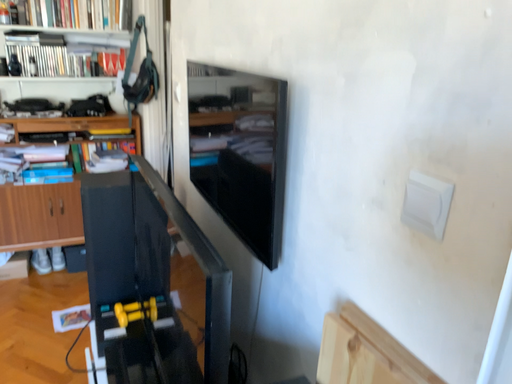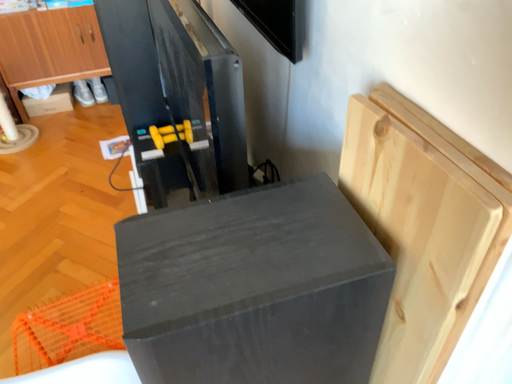
Question: How did the camera likely rotate when shooting the video?

Choices:
 (A) rotated upward
 (B) rotated downward

Answer: (B)